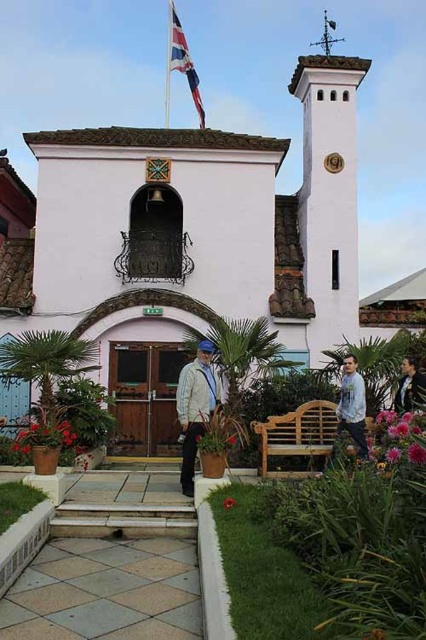
Question: Can you confirm if white stucco church at center is bigger than light brown leather jacket at lower right?

Choices:
 (A) yes
 (B) no

Answer: (A)

Question: Which point is closer to the camera taking this photo?

Choices:
 (A) (362, 436)
 (B) (192, 416)
 (C) (327, 33)

Answer: (A)

Question: Which of the following is the farthest from the observer?

Choices:
 (A) (339, 36)
 (B) (253, 310)

Answer: (A)

Question: Based on their relative distances, which object is farther from the denim jacket at lower right?

Choices:
 (A) white painted wood spire at upper center
 (B) union jack fabric flag at upper center
 (C) light brown leather jacket at lower right

Answer: (B)

Question: Can you confirm if denim jacket at lower right is wider than light brown leather jacket at lower right?

Choices:
 (A) yes
 (B) no

Answer: (B)

Question: Does light beige jacket at center lie behind denim jacket at lower right?

Choices:
 (A) yes
 (B) no

Answer: (A)